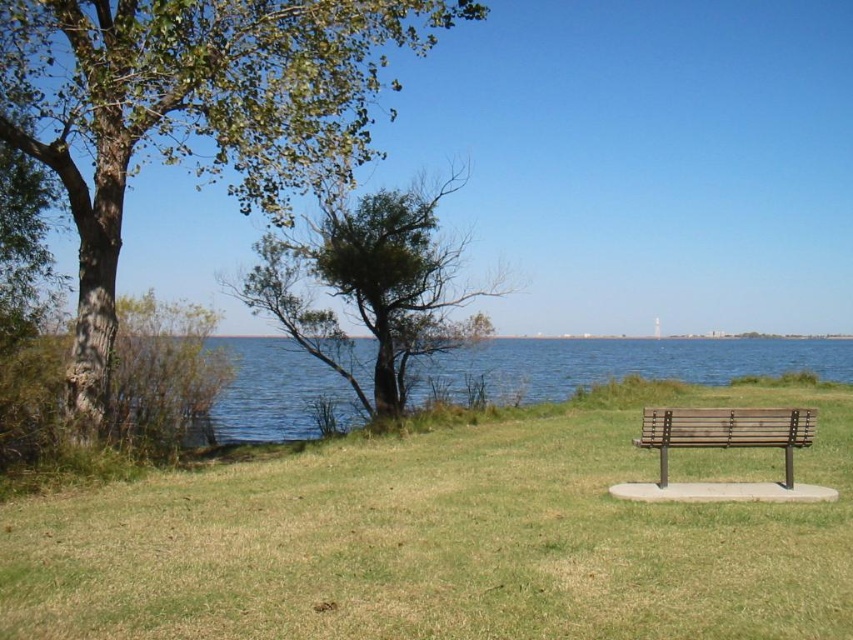
Question: Which object is closer to the camera taking this photo?

Choices:
 (A) green leafy tree at left
 (B) green grass at center

Answer: (B)

Question: Which object is farther from the camera taking this photo?

Choices:
 (A) green leafy tree at left
 (B) green leafy tree at center

Answer: (B)

Question: Is green leafy tree at left to the left of wooden bench at center from the viewer's perspective?

Choices:
 (A) yes
 (B) no

Answer: (A)

Question: Based on their relative distances, which object is farther from the green grass at center?

Choices:
 (A) wooden bench at center
 (B) green leafy tree at center
 (C) green leafy tree at left

Answer: (C)

Question: Can you confirm if green leafy tree at left is smaller than green leafy tree at center?

Choices:
 (A) no
 (B) yes

Answer: (A)

Question: Considering the relative positions of green grass at center and wooden bench at center in the image provided, where is green grass at center located with respect to wooden bench at center?

Choices:
 (A) below
 (B) above

Answer: (A)